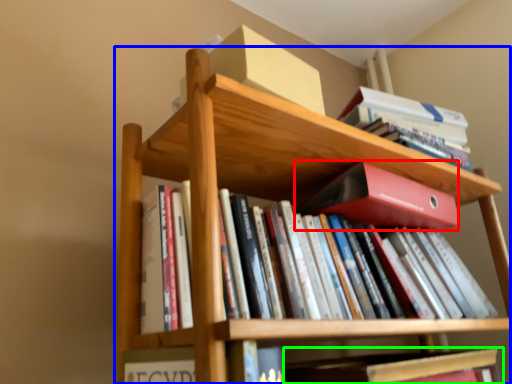
Question: Considering the real-world distances, which object is closest to paperback book (highlighted by a red box)? bookcase (highlighted by a blue box) or book (highlighted by a green box).

Choices:
 (A) bookcase
 (B) book

Answer: (A)